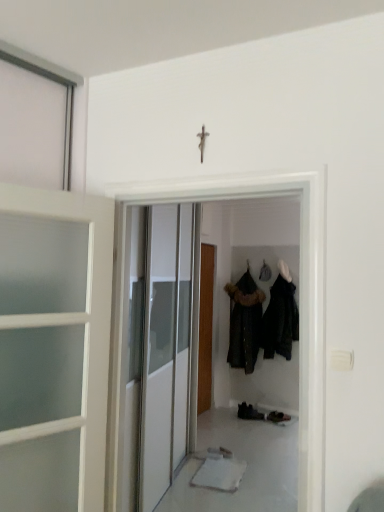
Question: Is dark matte coat at center, which appears as the first clothing when viewed from the right, in front of or behind white glossy door at center, the second door positioned from the back, in the image?

Choices:
 (A) behind
 (B) front

Answer: (A)

Question: From the image's perspective, is dark matte coat at center, which appears as the first clothing when viewed from the right, positioned above or below white glossy door at center, the second door positioned from the back?

Choices:
 (A) below
 (B) above

Answer: (A)

Question: Considering the real-world distances, which object is farthest from the white glossy door at center, placed as the first door when sorted from front to back?

Choices:
 (A) dark fur-trimmed coat at center, marked as the 2th clothing in a right-to-left arrangement
 (B) wooden door at center, positioned as the second door in front-to-back order
 (C) black leather shoes at lower center
 (D) dark matte coat at center, which appears as the first clothing when viewed from the right

Answer: (D)

Question: Estimate the real-world distances between objects in this image. Which object is closer to the dark matte coat at center, which appears as the first clothing when viewed from the right?

Choices:
 (A) dark fur-trimmed coat at center, acting as the first clothing starting from the left
 (B) black leather shoes at lower center
 (C) wooden door at center, positioned as the second door in front-to-back order
 (D) white glossy door at center, placed as the first door when sorted from front to back

Answer: (A)